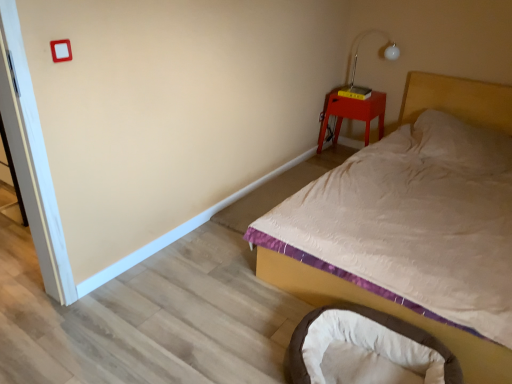
At what (x,y) coordinates should I click in order to perform the action: click on white quilted fabric bed at upper right. Please return your answer as a coordinate pair (x, y). Looking at the image, I should click on (384, 311).

The image size is (512, 384). Find the location of `brown plush infant bed at lower right`. brown plush infant bed at lower right is located at coordinates (366, 349).

The height and width of the screenshot is (384, 512). Describe the element at coordinates (352, 113) in the screenshot. I see `matte red wooden nightstand at upper right` at that location.

The width and height of the screenshot is (512, 384). I want to click on metallic silver table lamp at upper right, so 357,61.

Is matte red wooden nightstand at upper right spatially inside brown plush infant bed at lower right, or outside of it?

matte red wooden nightstand at upper right is not enclosed by brown plush infant bed at lower right.

Is matte red wooden nightstand at upper right wider or thinner than brown plush infant bed at lower right?

Considering their sizes, matte red wooden nightstand at upper right looks slimmer than brown plush infant bed at lower right.

The width and height of the screenshot is (512, 384). I want to click on infant bed below the matte red wooden nightstand at upper right (from the image's perspective), so click(x=366, y=349).

Between matte red wooden nightstand at upper right and brown plush infant bed at lower right, which one has larger size?

brown plush infant bed at lower right is bigger.

Based on the photo, which of these two, matte red wooden nightstand at upper right or metallic silver table lamp at upper right, is smaller?

metallic silver table lamp at upper right is smaller.

Can you confirm if matte red wooden nightstand at upper right is thinner than metallic silver table lamp at upper right?

No, matte red wooden nightstand at upper right is not thinner than metallic silver table lamp at upper right.

Does matte red wooden nightstand at upper right contain metallic silver table lamp at upper right?

No, metallic silver table lamp at upper right is not surrounded by matte red wooden nightstand at upper right.

Is matte red wooden nightstand at upper right facing towards metallic silver table lamp at upper right?

No.

Is brown plush infant bed at lower right facing towards matte red wooden nightstand at upper right?

No.

Is brown plush infant bed at lower right to the left of matte red wooden nightstand at upper right from the viewer's perspective?

Yes.

Who is more distant, brown plush infant bed at lower right or matte red wooden nightstand at upper right?

matte red wooden nightstand at upper right is more distant.

Between metallic silver table lamp at upper right and brown plush infant bed at lower right, which one is positioned behind?

metallic silver table lamp at upper right is further away from the camera.

Identify the location of table lamp above the brown plush infant bed at lower right (from a real-world perspective). The image size is (512, 384). (357, 61).

Between metallic silver table lamp at upper right and brown plush infant bed at lower right, which one has smaller width?

Thinner between the two is metallic silver table lamp at upper right.

Is metallic silver table lamp at upper right bigger or smaller than brown plush infant bed at lower right?

In the image, metallic silver table lamp at upper right appears to be smaller than brown plush infant bed at lower right.

Based on the photo, can you see metallic silver table lamp at upper right touching white quilted fabric bed at upper right?

No, metallic silver table lamp at upper right is not making contact with white quilted fabric bed at upper right.

Is metallic silver table lamp at upper right thinner than white quilted fabric bed at upper right?

Yes.

Looking at this image, which of these two, metallic silver table lamp at upper right or white quilted fabric bed at upper right, stands shorter?

metallic silver table lamp at upper right is shorter.

Is the surface of white quilted fabric bed at upper right in direct contact with matte red wooden nightstand at upper right?

white quilted fabric bed at upper right and matte red wooden nightstand at upper right are not in contact.

Is white quilted fabric bed at upper right taller than matte red wooden nightstand at upper right?

Yes.

Is white quilted fabric bed at upper right bigger or smaller than matte red wooden nightstand at upper right?

Considering their sizes, white quilted fabric bed at upper right takes up more space than matte red wooden nightstand at upper right.

Does white quilted fabric bed at upper right have a greater width compared to matte red wooden nightstand at upper right?

Indeed, white quilted fabric bed at upper right has a greater width compared to matte red wooden nightstand at upper right.

Consider the image. Would you say matte red wooden nightstand at upper right is part of metallic silver table lamp at upper right's contents?

No, matte red wooden nightstand at upper right is located outside of metallic silver table lamp at upper right.

Is metallic silver table lamp at upper right to the left or to the right of matte red wooden nightstand at upper right in the image?

Clearly, metallic silver table lamp at upper right is on the right of matte red wooden nightstand at upper right in the image.

This screenshot has width=512, height=384. In order to click on infant bed below the matte red wooden nightstand at upper right (from a real-world perspective) in this screenshot , I will do `click(366, 349)`.

Where is `table lamp to the right of matte red wooden nightstand at upper right`? Image resolution: width=512 pixels, height=384 pixels. table lamp to the right of matte red wooden nightstand at upper right is located at coordinates (357, 61).

Estimate the real-world distances between objects in this image. Which object is closer to metallic silver table lamp at upper right, matte red wooden nightstand at upper right or white quilted fabric bed at upper right?

The object closer to metallic silver table lamp at upper right is matte red wooden nightstand at upper right.

From the image, which object appears to be nearer to matte red wooden nightstand at upper right, metallic silver table lamp at upper right or white quilted fabric bed at upper right?

Among the two, metallic silver table lamp at upper right is located nearer to matte red wooden nightstand at upper right.

Which object lies nearer to the anchor point white quilted fabric bed at upper right, matte red wooden nightstand at upper right or brown plush infant bed at lower right?

brown plush infant bed at lower right is closer to white quilted fabric bed at upper right.

When comparing their distances from matte red wooden nightstand at upper right, does white quilted fabric bed at upper right or metallic silver table lamp at upper right seem further?

Based on the image, white quilted fabric bed at upper right appears to be further to matte red wooden nightstand at upper right.

Which object lies further to the anchor point matte red wooden nightstand at upper right, brown plush infant bed at lower right or white quilted fabric bed at upper right?

Based on the image, brown plush infant bed at lower right appears to be further to matte red wooden nightstand at upper right.

In the scene shown: Estimate the real-world distances between objects in this image. Which object is further from metallic silver table lamp at upper right, brown plush infant bed at lower right or matte red wooden nightstand at upper right?

Based on the image, brown plush infant bed at lower right appears to be further to metallic silver table lamp at upper right.

Considering their positions, is metallic silver table lamp at upper right positioned further to matte red wooden nightstand at upper right than brown plush infant bed at lower right?

The object further to matte red wooden nightstand at upper right is brown plush infant bed at lower right.

From the image, which object appears to be nearer to metallic silver table lamp at upper right, matte red wooden nightstand at upper right or brown plush infant bed at lower right?

Among the two, matte red wooden nightstand at upper right is located nearer to metallic silver table lamp at upper right.

You are a GUI agent. You are given a task and a screenshot of the screen. Output one action in this format:
    pyautogui.click(x=<x>, y=<y>)
    Task: Click on the table lamp located between brown plush infant bed at lower right and matte red wooden nightstand at upper right in the depth direction
    The width and height of the screenshot is (512, 384).
    Given the screenshot: What is the action you would take?
    pyautogui.click(x=357, y=61)

This screenshot has height=384, width=512. What are the coordinates of `table lamp located between white quilted fabric bed at upper right and matte red wooden nightstand at upper right in the depth direction` in the screenshot? It's located at (357, 61).

This screenshot has height=384, width=512. What are the coordinates of `bed positioned between brown plush infant bed at lower right and matte red wooden nightstand at upper right from near to far` in the screenshot? It's located at (384, 311).

Where is `bed between brown plush infant bed at lower right and metallic silver table lamp at upper right from front to back`? bed between brown plush infant bed at lower right and metallic silver table lamp at upper right from front to back is located at coordinates (384, 311).